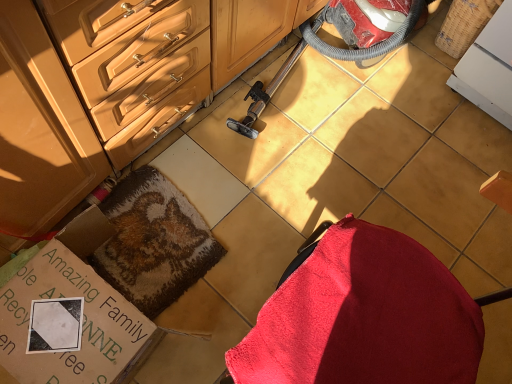
This screenshot has height=384, width=512. I want to click on free region under fluffy brown rug at center (from a real-world perspective), so click(158, 229).